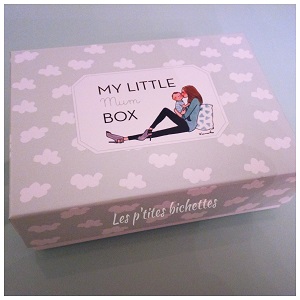
In order to click on pink box in this screenshot , I will do `click(226, 123)`.